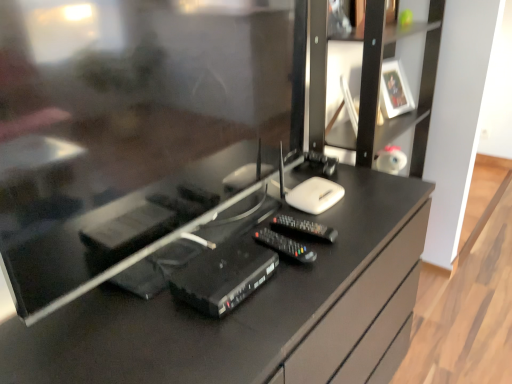
Identify the location of empty space that is ontop of black plastic router at center, placed as the first equipment when sorted from left to right (from a real-world perspective). (219, 268).